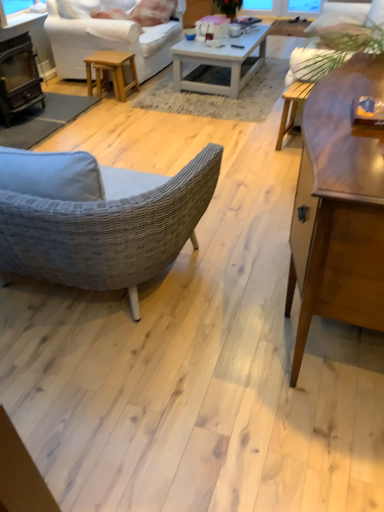
This screenshot has width=384, height=512. Find the location of `blank space above white glossy coffee table at center, the second coffee table when ordered from front to back (from a real-world perspective)`. blank space above white glossy coffee table at center, the second coffee table when ordered from front to back (from a real-world perspective) is located at coordinates (228, 39).